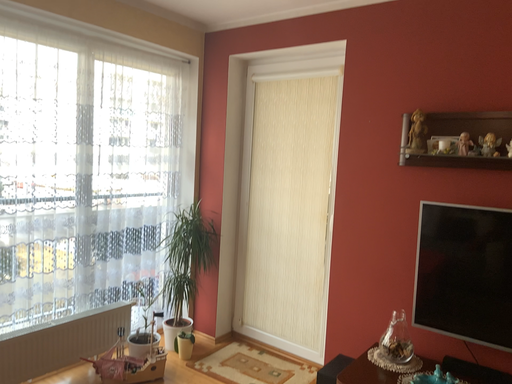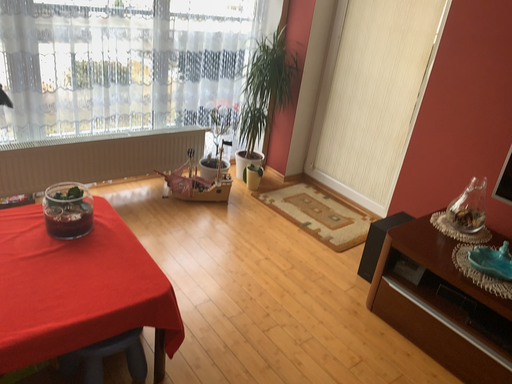
Question: How did the camera likely rotate when shooting the video?

Choices:
 (A) rotated downward
 (B) rotated upward

Answer: (A)